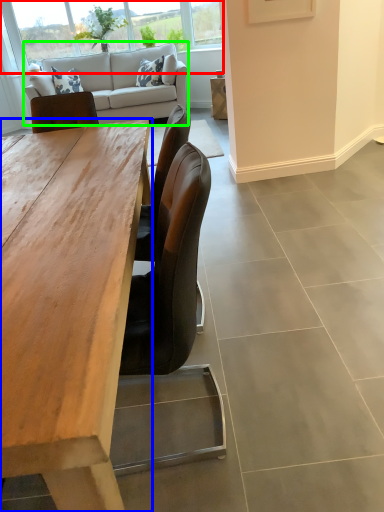
Question: Estimate the real-world distances between objects in this image. Which object is closer to window (highlighted by a red box), desk (highlighted by a blue box) or studio couch (highlighted by a green box)?

Choices:
 (A) desk
 (B) studio couch

Answer: (B)